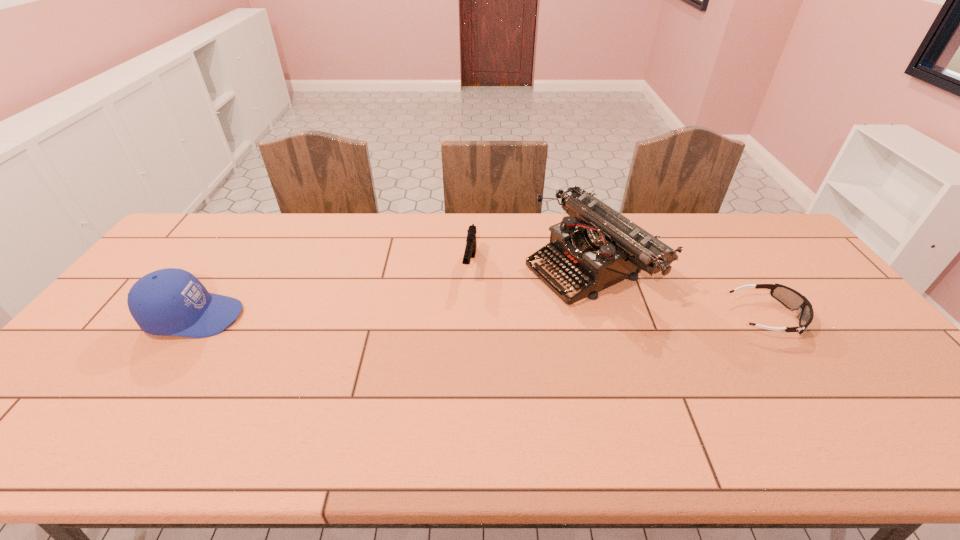
In the image, there is a desktop. At what (x,y) coordinates should I click in order to perform the action: click on blank space at the far edge. Please return your answer as a coordinate pair (x, y). The image size is (960, 540). Looking at the image, I should click on (421, 222).

The height and width of the screenshot is (540, 960). In the image, there is a desktop. Identify the location of free space at the near edge. (120, 383).

In the image, there is a desktop. At what (x,y) coordinates should I click in order to perform the action: click on vacant space at the far left corner. Please return your answer as a coordinate pair (x, y). Looking at the image, I should click on (209, 245).

In order to click on vacant space at the far right corner of the desktop in this screenshot , I will do `click(752, 215)`.

The image size is (960, 540). I want to click on empty location between the third tallest object and the leftmost object, so click(x=332, y=291).

You are a GUI agent. You are given a task and a screenshot of the screen. Output one action in this format:
    pyautogui.click(x=<x>, y=<y>)
    Task: Click on the free space between the pistol and the rightmost object
    This screenshot has height=540, width=960.
    Given the screenshot: What is the action you would take?
    pyautogui.click(x=618, y=291)

Locate an element on the screen. vacant space that's between the third object from left to right and the leftmost object is located at coordinates (393, 291).

This screenshot has height=540, width=960. Identify the location of vacant area that lies between the goggles and the tallest object. (x=679, y=291).

At what (x,y) coordinates should I click in order to perform the action: click on vacant area between the shortest object and the typewriter. Please return your answer as a coordinate pair (x, y). Looking at the image, I should click on (679, 291).

This screenshot has width=960, height=540. I want to click on free space between the shortest object and the tallest object, so click(679, 291).